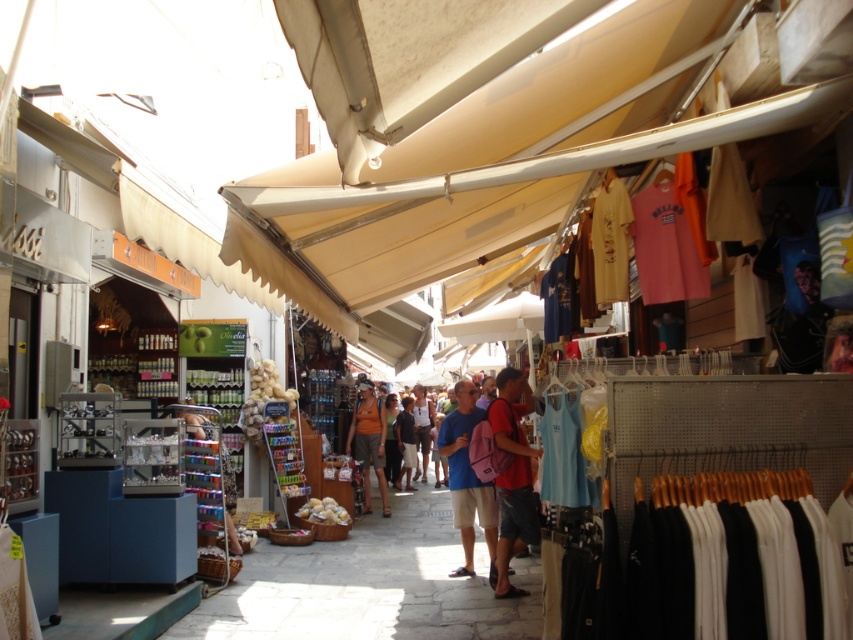
Question: Which of the following is the farthest from the observer?

Choices:
 (A) orange cotton t-shirt at center
 (B) matte white shirt at center

Answer: (B)

Question: Which object is the farthest from the metallic silver canister at center?

Choices:
 (A) orange cotton t-shirt at center
 (B) matte white shirt at center
 (C) matte blue shirt at center
 (D) blue fabric backpack at center

Answer: (B)

Question: Which object is the farthest from the matte red backpack at center?

Choices:
 (A) metallic silver canister at center
 (B) matte blue shirt at center

Answer: (B)

Question: Does metallic silver canister at center appear on the right side of matte blue shirt at center?

Choices:
 (A) yes
 (B) no

Answer: (B)

Question: Is matte white shirt at center above matte blue shirt at center?

Choices:
 (A) no
 (B) yes

Answer: (A)

Question: Can you confirm if matte red backpack at center is positioned below metallic silver canister at center?

Choices:
 (A) no
 (B) yes

Answer: (A)